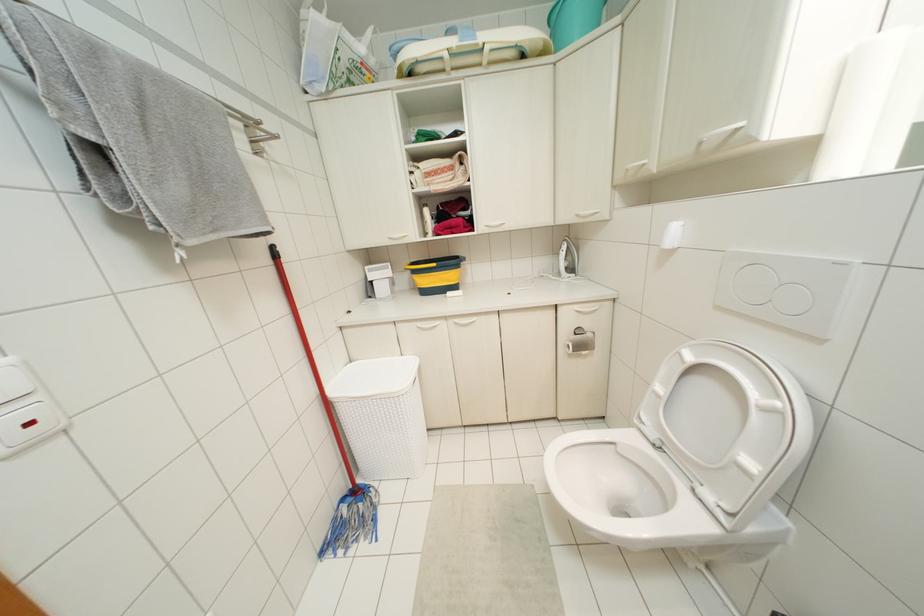
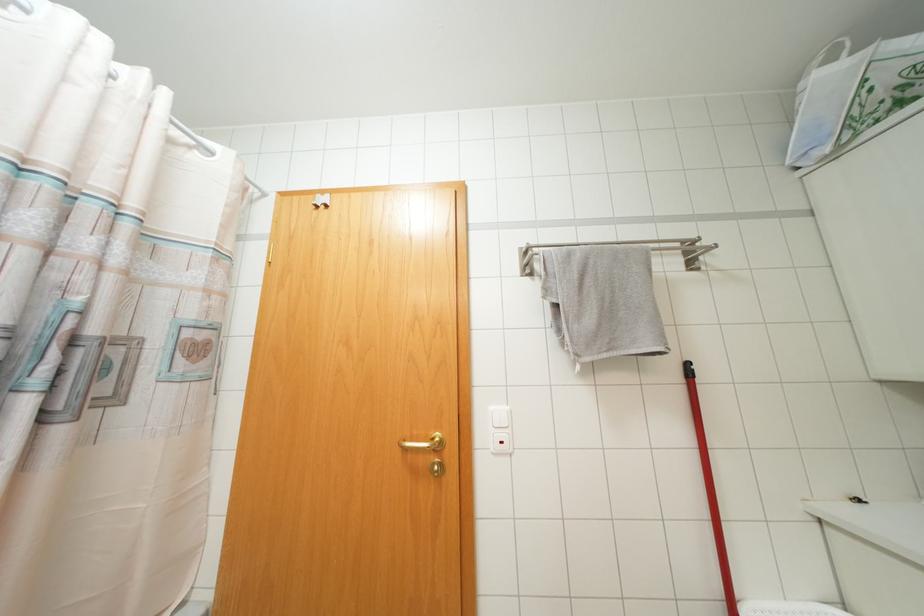
Question: The camera is either moving clockwise (left) or counter-clockwise (right) around the object. The first image is from the beginning of the video and the second image is from the end. Is the camera moving left or right when shooting the video?

Choices:
 (A) Left
 (B) Right

Answer: (B)